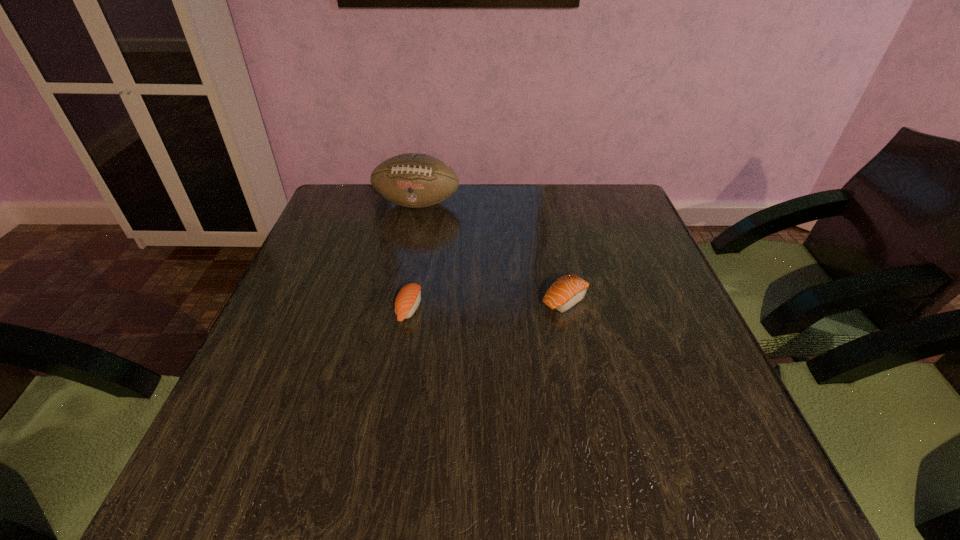
Where is `the farthest object`? The height and width of the screenshot is (540, 960). the farthest object is located at coordinates (413, 180).

Image resolution: width=960 pixels, height=540 pixels. I want to click on the tallest object, so point(413,180).

Image resolution: width=960 pixels, height=540 pixels. I want to click on the left sushi, so [x=407, y=301].

At what (x,y) coordinates should I click in order to perform the action: click on the rightmost object. Please return your answer as a coordinate pair (x, y). Looking at the image, I should click on (568, 290).

You are a GUI agent. You are given a task and a screenshot of the screen. Output one action in this format:
    pyautogui.click(x=<x>, y=<y>)
    Task: Click on the vacant space located 0.330m on the laces of the football (American)
    The image size is (960, 540).
    Given the screenshot: What is the action you would take?
    pyautogui.click(x=397, y=303)

The height and width of the screenshot is (540, 960). I want to click on vacant point located 0.350m on the right of the left sushi, so click(584, 309).

Locate an element on the screen. vacant space located on the back of the rightmost object is located at coordinates pyautogui.click(x=557, y=260).

Locate an element on the screen. This screenshot has height=540, width=960. object situated at the far edge is located at coordinates (413, 180).

Identify the location of object that is positioned at the left edge. (413, 180).

Locate an element on the screen. object that is at the far left corner is located at coordinates (413, 180).